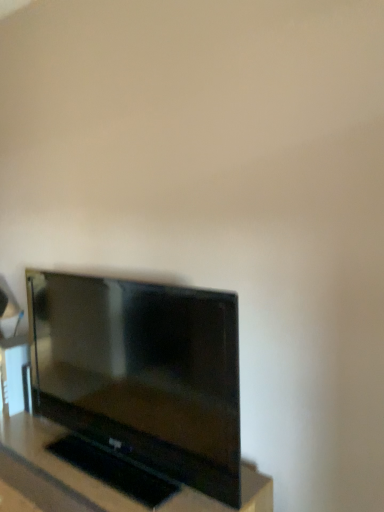
Question: Is matte black tv at lower left inside the boundaries of black glossy tv at center, or outside?

Choices:
 (A) inside
 (B) outside

Answer: (B)

Question: Is matte black tv at lower left bigger or smaller than black glossy tv at center?

Choices:
 (A) big
 (B) small

Answer: (B)

Question: From a real-world perspective, relative to black glossy tv at center, is matte black tv at lower left vertically above or below?

Choices:
 (A) below
 (B) above

Answer: (B)

Question: In terms of height, does black glossy tv at center look taller or shorter compared to matte black tv at lower left?

Choices:
 (A) short
 (B) tall

Answer: (B)

Question: From a real-world perspective, is black glossy tv at center above or below matte black tv at lower left?

Choices:
 (A) above
 (B) below

Answer: (B)

Question: Is point (92, 483) positioned closer to the camera than point (188, 434)?

Choices:
 (A) farther
 (B) closer

Answer: (A)

Question: Relative to matte black tv at lower left, is black glossy tv at center in front or behind?

Choices:
 (A) front
 (B) behind

Answer: (A)